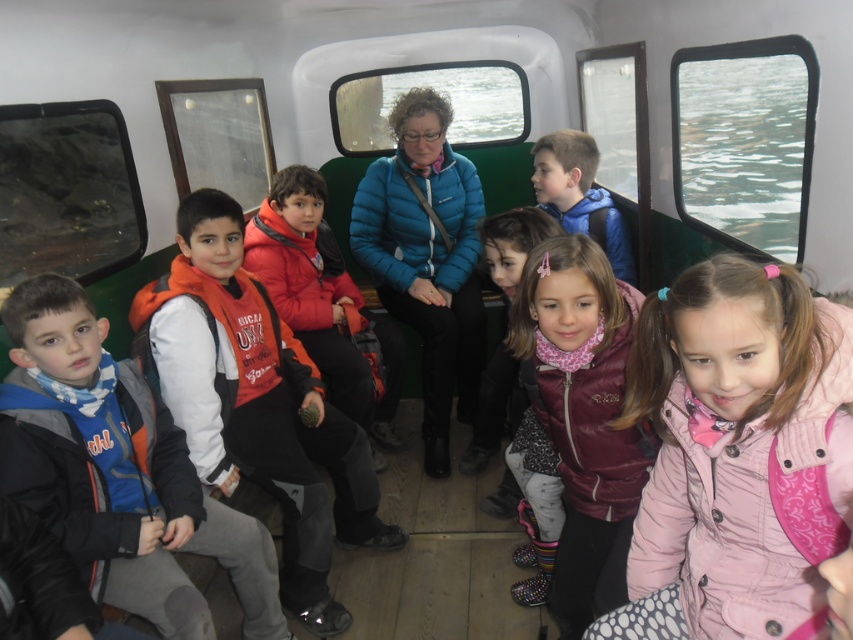
Between orange fleece jacket at center and pink fleece vest at center, which one has less height?

Standing shorter between the two is pink fleece vest at center.

Which is behind, point (225, 314) or point (490, 364)?

The point (490, 364) is behind.

The height and width of the screenshot is (640, 853). I want to click on orange fleece jacket at center, so click(x=256, y=404).

Between point (676, 417) and point (593, 221), which one is positioned behind?

The point (593, 221) is behind.

Is point (727, 340) behind point (573, 205)?

No, it is not.

I want to click on pink quilted jacket at lower right, so click(x=737, y=454).

Is the position of blue quilted jacket at center less distant than that of blue matte jacket at center?

No, blue quilted jacket at center is further to the viewer.

Is point (445, 396) farther from viewer compared to point (610, 241)?

Yes, it is behind point (610, 241).

Locate an element on the screen. The height and width of the screenshot is (640, 853). blue quilted jacket at center is located at coordinates (427, 257).